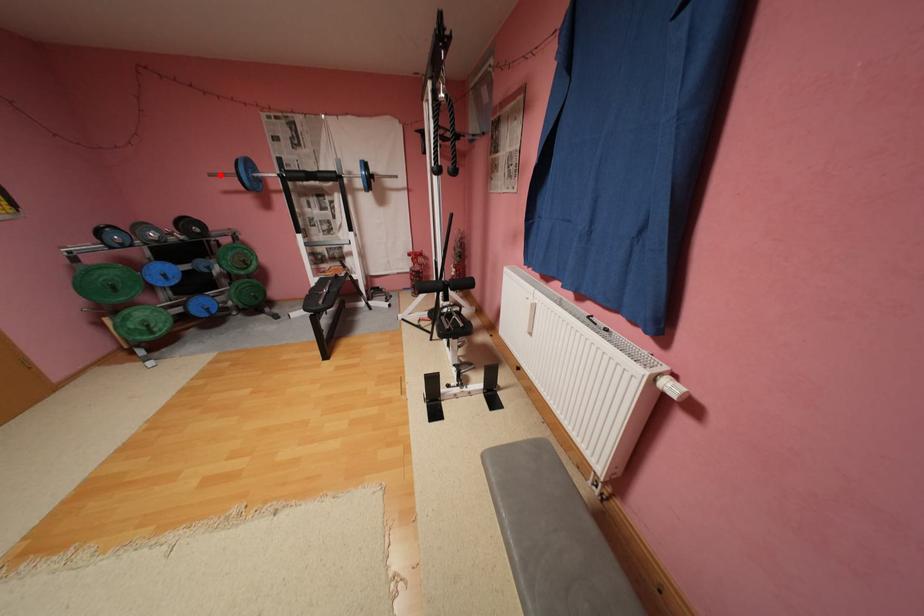
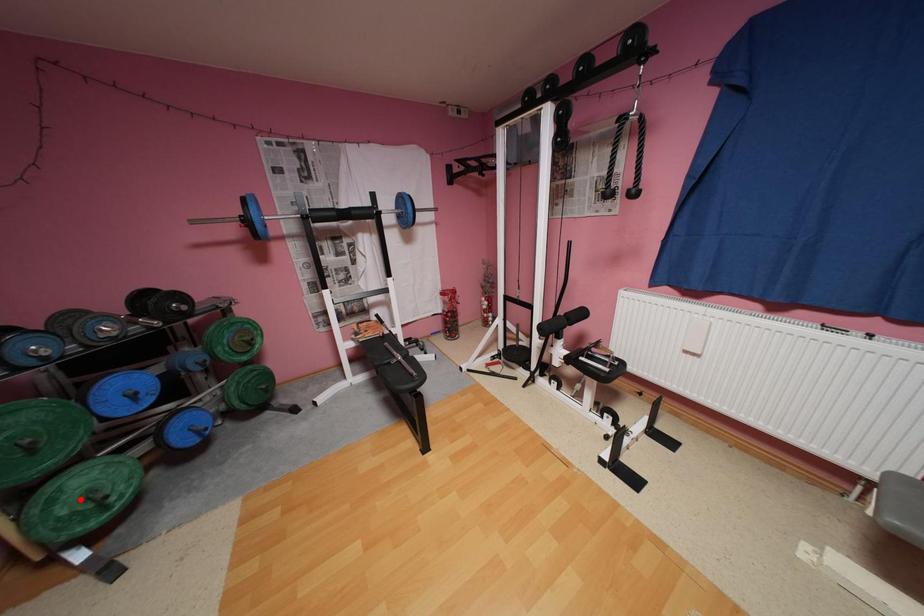
I am providing you with two images of the same scene from different viewpoints. A red point is marked on the first image and another point is marked on the second image. Are the points marked in image1 and image2 representing the same 3D position?

No